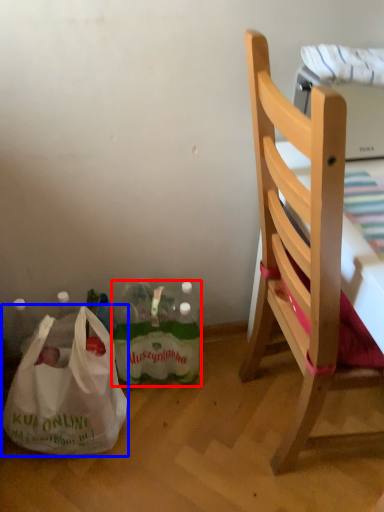
Question: Which object appears farthest to the camera in this image, bottle (highlighted by a red box) or plastic bag (highlighted by a blue box)?

Choices:
 (A) bottle
 (B) plastic bag

Answer: (A)